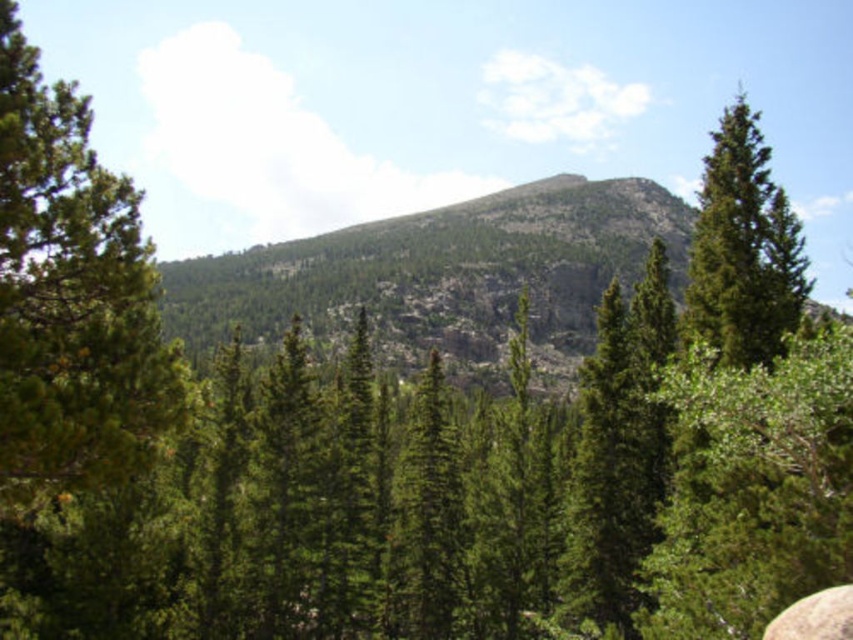
You are standing at the base of the mountain and want to place a 30 meter long rope between the green matte tree at left and the green matte tree at upper right. Will the rope be long enough to reach both trees?

The distance between the green matte tree at left and the green matte tree at upper right is 29.66 meters. Since the rope is 30 meters long, it will be long enough to reach both trees with a little extra length remaining.